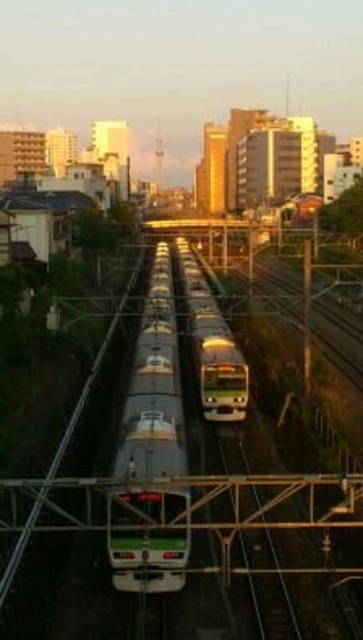
You are a passenger on the silver metallic train at center and want to board the green metallic train at center. Which direction should you move to reach it?

The silver metallic train at center is to the left of the green metallic train at center, so you should move to the right to reach it.

You are a passenger on the silver metallic train at center and want to see the green metallic train at center. Since both are on the same track, can you see it from your current position?

The silver metallic train at center is located below the green metallic train at center, so you cannot see it directly from your current position on the silver metallic train at center.